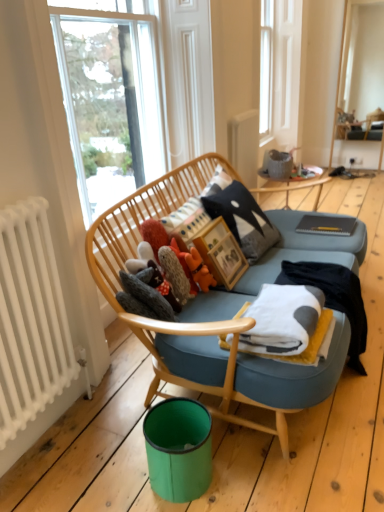
Question: Does matte gray vase at upper center have a smaller size compared to fuzzy gray stuffed animal at center, which is counted as the third toy, starting from the right?

Choices:
 (A) no
 (B) yes

Answer: (A)

Question: Considering the relative sizes of matte gray vase at upper center and fuzzy gray stuffed animal at center, the first toy when ordered from left to right, in the image provided, is matte gray vase at upper center thinner than fuzzy gray stuffed animal at center, the first toy when ordered from left to right,?

Choices:
 (A) yes
 (B) no

Answer: (A)

Question: From a real-world perspective, is matte gray vase at upper center under fuzzy gray stuffed animal at center, the first toy when ordered from left to right?

Choices:
 (A) yes
 (B) no

Answer: (B)

Question: Is matte gray vase at upper center located outside fuzzy gray stuffed animal at center, which is counted as the third toy, starting from the right?

Choices:
 (A) yes
 (B) no

Answer: (A)

Question: Can you confirm if matte gray vase at upper center is wider than fuzzy gray stuffed animal at center, which is counted as the third toy, starting from the right?

Choices:
 (A) yes
 (B) no

Answer: (B)

Question: In terms of width, does teal plastic bin at lower center look wider or thinner when compared to white soft blanket at center?

Choices:
 (A) thin
 (B) wide

Answer: (A)

Question: Is point (185, 433) closer or farther from the camera than point (274, 320)?

Choices:
 (A) farther
 (B) closer

Answer: (A)

Question: From a real-world perspective, is teal plastic bin at lower center above or below white soft blanket at center?

Choices:
 (A) above
 (B) below

Answer: (B)

Question: From the image's perspective, is teal plastic bin at lower center located above or below white soft blanket at center?

Choices:
 (A) below
 (B) above

Answer: (A)

Question: From a real-world perspective, is matte gray vase at upper center above or below white soft blanket at center?

Choices:
 (A) below
 (B) above

Answer: (B)

Question: Considering their positions, is matte gray vase at upper center located in front of or behind white soft blanket at center?

Choices:
 (A) front
 (B) behind

Answer: (B)

Question: Choose the correct answer: Is matte gray vase at upper center inside white soft blanket at center or outside it?

Choices:
 (A) outside
 (B) inside

Answer: (A)

Question: Is matte gray vase at upper center taller or shorter than white soft blanket at center?

Choices:
 (A) short
 (B) tall

Answer: (B)

Question: Considering their positions, is teal plastic bin at lower center located in front of or behind fluffy orange toy at center, marked as the first toy in a right-to-left arrangement?

Choices:
 (A) behind
 (B) front

Answer: (B)

Question: Considering the positions of point (160, 497) and point (210, 276), is point (160, 497) closer or farther from the camera than point (210, 276)?

Choices:
 (A) farther
 (B) closer

Answer: (B)